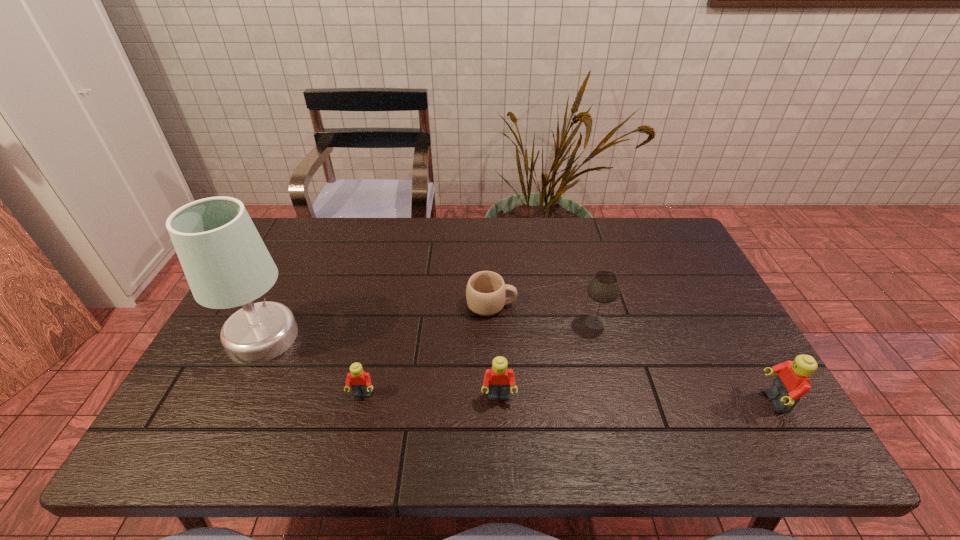
Find the location of `free space between the lampshade and the shortest object`. free space between the lampshade and the shortest object is located at coordinates (377, 321).

Where is `free space between the tallest object and the second object from left to right`? The image size is (960, 540). free space between the tallest object and the second object from left to right is located at coordinates (313, 366).

Where is `unoccupied area between the mug and the second object from right to left`? This screenshot has width=960, height=540. unoccupied area between the mug and the second object from right to left is located at coordinates (543, 314).

You are a GUI agent. You are given a task and a screenshot of the screen. Output one action in this format:
    pyautogui.click(x=<x>, y=<y>)
    Task: Click on the empty location between the fifth object from right to left and the wineglass
    Image resolution: width=960 pixels, height=540 pixels.
    Given the screenshot: What is the action you would take?
    pyautogui.click(x=479, y=359)

You are a GUI agent. You are given a task and a screenshot of the screen. Output one action in this format:
    pyautogui.click(x=<x>, y=<y>)
    Task: Click on the unoccupied area between the tallest Lego and the wineglass
    Image resolution: width=960 pixels, height=540 pixels.
    Given the screenshot: What is the action you would take?
    pyautogui.click(x=685, y=362)

Locate an element on the screen. This screenshot has width=960, height=540. empty location between the tallest object and the mug is located at coordinates (377, 321).

Locate which object ranks third in proximity to the fifth object from right to left. Please provide its 2D coordinates. Your answer should be formatted as a tuple, i.e. [(x, y)], where the tuple contains the x and y coordinates of a point satisfying the conditions above.

[(486, 291)]

I want to click on the closest object to the fifth object from right to left, so click(x=226, y=263).

Point out which Lego is positioned as the third nearest to the wineglass. Please provide its 2D coordinates. Your answer should be formatted as a tuple, i.e. [(x, y)], where the tuple contains the x and y coordinates of a point satisfying the conditions above.

[(360, 381)]

At what (x,y) coordinates should I click in order to perform the action: click on Lego that is the closest to the third shortest object. Please return your answer as a coordinate pair (x, y). This screenshot has height=540, width=960. Looking at the image, I should click on (360, 381).